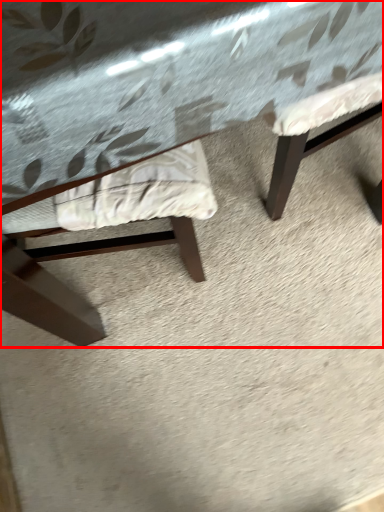
Question: From the image's perspective, what is the correct spatial positioning of table (annotated by the red box) in reference to chair?

Choices:
 (A) below
 (B) above

Answer: (B)